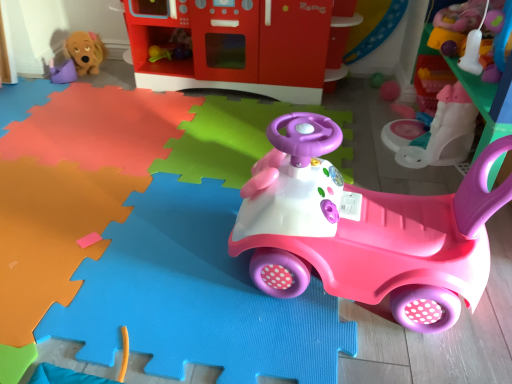
Locate an element on the screen. This screenshot has width=512, height=384. vacant space situated on the left part of matte purple toy at upper left, which is the sixth toy in right-to-left order is located at coordinates (27, 81).